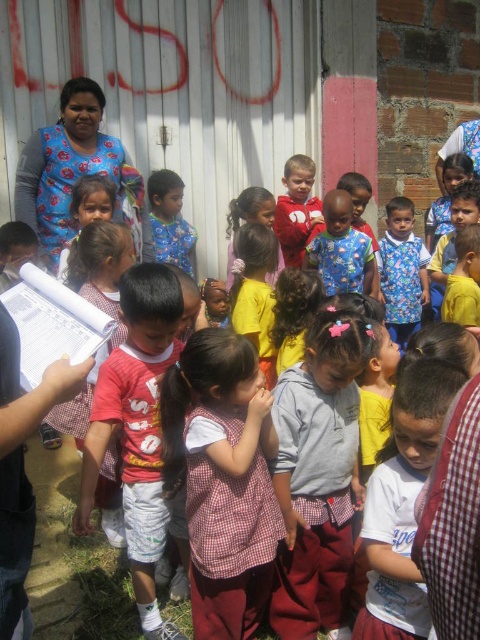
Does checkered fabric dress at center have a smaller size compared to red cotton shirt at center?

Indeed, checkered fabric dress at center has a smaller size compared to red cotton shirt at center.

The width and height of the screenshot is (480, 640). Describe the element at coordinates (223, 477) in the screenshot. I see `checkered fabric dress at center` at that location.

Find the location of a particular element. checkered fabric dress at center is located at coordinates (223, 477).